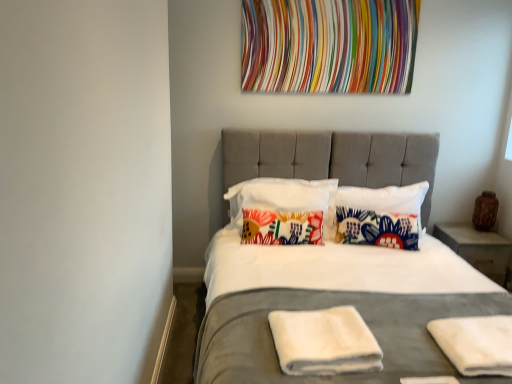
What do you see at coordinates (324, 342) in the screenshot? I see `white towel at center, which is counted as the 1th material, starting from the left` at bounding box center [324, 342].

Identify the location of multicolored fabric at upper center. (329, 46).

How much space does floral fabric pillow at center, which appears as the 4th pillow when viewed from the right, occupy vertically?

13.78 inches.

Where is `concrete/rough nightstand at right`? concrete/rough nightstand at right is located at coordinates (477, 248).

Is floral fabric pillow at center, marked as the fourth pillow in a left-to-right arrangement, located outside multicolored fabric at upper center?

Yes, floral fabric pillow at center, marked as the fourth pillow in a left-to-right arrangement, is located beyond the bounds of multicolored fabric at upper center.

Which of these two, floral fabric pillow at center, which appears as the 1th pillow when viewed from the right, or multicolored fabric at upper center, is smaller?

Smaller between the two is multicolored fabric at upper center.

From a real-world perspective, is floral fabric pillow at center, which appears as the 1th pillow when viewed from the right, positioned under multicolored fabric at upper center based on gravity?

Yes, from a real-world perspective, floral fabric pillow at center, which appears as the 1th pillow when viewed from the right, is beneath multicolored fabric at upper center.

From the picture: Is matte gray bed at center positioned far away from floral fabric pillow at center, the 1th pillow positioned from the left?

No.

From a real-world perspective, who is located lower, matte gray bed at center or floral fabric pillow at center, which appears as the 4th pillow when viewed from the right?

matte gray bed at center is physically lower.

In the scene shown: Between matte gray bed at center and floral fabric pillow at center, the 1th pillow positioned from the left, which one has smaller size?

floral fabric pillow at center, the 1th pillow positioned from the left, is smaller.

From a real-world perspective, is white towel at center, which is counted as the 1th material, starting from the left, positioned under floral fabric pillow at center, marked as the fourth pillow in a left-to-right arrangement, based on gravity?

Yes, from a real-world perspective, white towel at center, which is counted as the 1th material, starting from the left, is beneath floral fabric pillow at center, marked as the fourth pillow in a left-to-right arrangement.

Find the location of a particular element. Image resolution: width=512 pixels, height=384 pixels. material that is the 2nd one when counting forward from the floral fabric pillow at center, which appears as the 1th pillow when viewed from the right is located at coordinates (324, 342).

Can we say white towel at center, which is counted as the 1th material, starting from the left, lies outside floral fabric pillow at center, marked as the fourth pillow in a left-to-right arrangement?

Yes, white towel at center, which is counted as the 1th material, starting from the left, is outside of floral fabric pillow at center, marked as the fourth pillow in a left-to-right arrangement.

Which object is more forward, floral fabric pillow at center, the 1th pillow positioned from the left, or matte gray bed at center?

Positioned in front is matte gray bed at center.

Find the location of a particular element. This screenshot has width=512, height=384. the 2nd pillow counting from the left of the matte gray bed at center is located at coordinates (281, 227).

Does floral fabric pillow at center, which appears as the 4th pillow when viewed from the right, have a larger size compared to matte gray bed at center?

No, floral fabric pillow at center, which appears as the 4th pillow when viewed from the right, is not bigger than matte gray bed at center.

In the scene shown: From a real-world perspective, is floral fabric pillow at center, the 1th pillow positioned from the left, on top of matte gray bed at center?

Yes, from a real-world perspective, floral fabric pillow at center, the 1th pillow positioned from the left, is above matte gray bed at center.

Is floral fabric pillow at center, marked as the fourth pillow in a left-to-right arrangement, situated inside concrete/rough nightstand at right or outside?

floral fabric pillow at center, marked as the fourth pillow in a left-to-right arrangement, is spatially situated outside concrete/rough nightstand at right.

Measure the distance from floral fabric pillow at center, marked as the fourth pillow in a left-to-right arrangement, to concrete/rough nightstand at right.

floral fabric pillow at center, marked as the fourth pillow in a left-to-right arrangement, and concrete/rough nightstand at right are 18.77 inches apart.

Locate an element on the screen. This screenshot has width=512, height=384. nightstand behind the floral fabric pillow at center, marked as the fourth pillow in a left-to-right arrangement is located at coordinates (477, 248).

Does floral fabric pillow at center, which appears as the 1th pillow when viewed from the right, appear on the left side of concrete/rough nightstand at right?

Yes.

Measure the distance from concrete/rough nightstand at right to white towel at center, arranged as the second material when viewed from the right.

concrete/rough nightstand at right and white towel at center, arranged as the second material when viewed from the right, are 1.61 meters apart.

Is concrete/rough nightstand at right touching white towel at center, which is counted as the 1th material, starting from the left?

concrete/rough nightstand at right and white towel at center, which is counted as the 1th material, starting from the left, are clearly separated.

What's the angular difference between concrete/rough nightstand at right and white towel at center, which is counted as the 1th material, starting from the left,'s facing directions?

The angular difference between concrete/rough nightstand at right and white towel at center, which is counted as the 1th material, starting from the left, is 4.19 degrees.

Which of these two, concrete/rough nightstand at right or white towel at center, arranged as the second material when viewed from the right, is bigger?

Bigger between the two is concrete/rough nightstand at right.

Which is closer to the camera, (479, 264) or (400, 206)?

Point (479, 264)

This screenshot has width=512, height=384. In order to click on nightstand on the right of the floral fabric pillow at center, which appears as the 1th pillow when viewed from the right in this screenshot , I will do `click(477, 248)`.

Consider the image. Does concrete/rough nightstand at right appear on the right side of floral fabric pillow at center, which appears as the 1th pillow when viewed from the right?

Correct, you'll find concrete/rough nightstand at right to the right of floral fabric pillow at center, which appears as the 1th pillow when viewed from the right.

In order to click on the 2nd pillow counting from the right side of the multicolored fabric at upper center in this screenshot , I will do `click(380, 215)`.

You are a GUI agent. You are given a task and a screenshot of the screen. Output one action in this format:
    pyautogui.click(x=<x>, y=<y>)
    Task: Click on the 2nd pillow counting from the left of the matte gray bed at center
    
    Given the screenshot: What is the action you would take?
    pyautogui.click(x=281, y=227)

Estimate the real-world distances between objects in this image. Which object is closer to concrete/rough nightstand at right, multicolored fabric at upper center or floral fabric pillow at center, marked as the fourth pillow in a left-to-right arrangement?

floral fabric pillow at center, marked as the fourth pillow in a left-to-right arrangement, lies closer to concrete/rough nightstand at right than the other object.

Estimate the real-world distances between objects in this image. Which object is further from floral fabric pillow at center, the 1th pillow positioned from the left, white cotton pillow at center, which is the third pillow in right-to-left order, or concrete/rough nightstand at right?

concrete/rough nightstand at right.

Based on their spatial positions, is multicolored fabric at upper center or white cotton pillow at center, which is the third pillow in right-to-left order, further from white soft towel at lower right, the 2th material viewed from the left?

multicolored fabric at upper center.

Based on their spatial positions, is white cotton pillow at center, which is the third pillow in right-to-left order, or multicolored fabric at upper center closer to floral fabric pillow at center, the 1th pillow positioned from the left?

white cotton pillow at center, which is the third pillow in right-to-left order, is positioned closer to the anchor floral fabric pillow at center, the 1th pillow positioned from the left.

Based on their spatial positions, is matte gray bed at center or floral fabric pillow at center, the 2th pillow from the right, further from floral fabric pillow at center, marked as the fourth pillow in a left-to-right arrangement?

matte gray bed at center is further to floral fabric pillow at center, marked as the fourth pillow in a left-to-right arrangement.

From the image, which object appears to be farther from multicolored fabric at upper center, white soft towel at lower right, the 2th material viewed from the left, or floral fabric pillow at center, which appears as the 1th pillow when viewed from the right?

Among the two, white soft towel at lower right, the 2th material viewed from the left, is located further to multicolored fabric at upper center.

Considering their positions, is matte gray bed at center positioned further to white towel at center, arranged as the second material when viewed from the right, than concrete/rough nightstand at right?

concrete/rough nightstand at right is positioned further to the anchor white towel at center, arranged as the second material when viewed from the right.

Estimate the real-world distances between objects in this image. Which object is closer to floral fabric pillow at center, which appears as the 4th pillow when viewed from the right, white cotton pillow at center, which is the third pillow in right-to-left order, or floral fabric pillow at center, marked as the fourth pillow in a left-to-right arrangement?

→ white cotton pillow at center, which is the third pillow in right-to-left order, is positioned closer to the anchor floral fabric pillow at center, which appears as the 4th pillow when viewed from the right.

Find the location of a particular element. This screenshot has width=512, height=384. nightstand that lies between multicolored fabric at upper center and white towel at center, arranged as the second material when viewed from the right, from top to bottom is located at coordinates (477, 248).

Image resolution: width=512 pixels, height=384 pixels. In order to click on tapestry between matte gray bed at center and concrete/rough nightstand at right from front to back in this screenshot , I will do `click(329, 46)`.

At what (x,y) coordinates should I click in order to perform the action: click on pillow between matte gray bed at center and floral fabric pillow at center, the 2th pillow from the right, in the front-back direction. Please return your answer as a coordinate pair (x, y). Looking at the image, I should click on (281, 227).

Where is `material located between white towel at center, arranged as the second material when viewed from the right, and floral fabric pillow at center, which appears as the 4th pillow when viewed from the right, in the depth direction`? This screenshot has height=384, width=512. material located between white towel at center, arranged as the second material when viewed from the right, and floral fabric pillow at center, which appears as the 4th pillow when viewed from the right, in the depth direction is located at coordinates (476, 343).